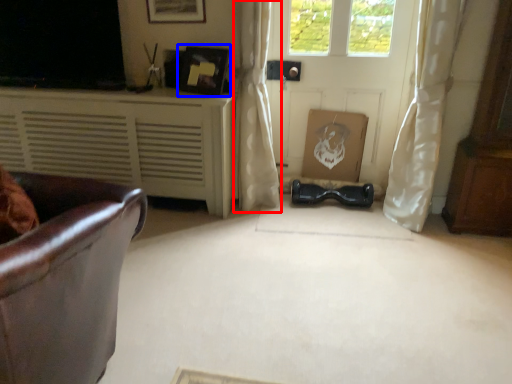
Question: Which object is closer to the camera taking this photo, curtain (highlighted by a red box) or picture frame (highlighted by a blue box)?

Choices:
 (A) curtain
 (B) picture frame

Answer: (A)